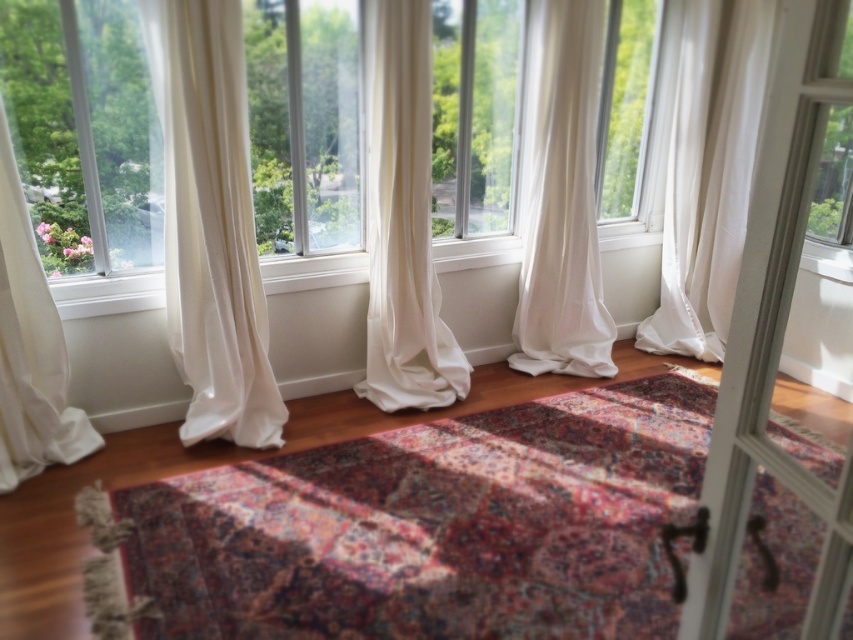
Which is more to the left, sheer white curtain at left or white sheer curtain at center?

Positioned to the left is sheer white curtain at left.

Who is more distant from viewer, (198, 44) or (541, 320)?

The point (541, 320) is more distant.

Is point (178, 128) positioned behind point (606, 333)?

No.

Find the location of `sheer white curtain at left`. sheer white curtain at left is located at coordinates (212, 221).

Is clear glass window at center closer to the viewer compared to white sheer curtain at left?

No, it is not.

Does point (252, 33) come in front of point (39, 465)?

No, (252, 33) is further to viewer.

Image resolution: width=853 pixels, height=640 pixels. I want to click on clear glass window at center, so click(x=305, y=124).

Can you confirm if white sheer curtain at center is smaller than white sheer curtain at left?

No.

Looking at this image, can you confirm if white sheer curtain at center is positioned below white sheer curtain at left?

No.

Is point (537, 131) farther from camera compared to point (15, 458)?

Yes, it is behind point (15, 458).

Locate an element on the screen. This screenshot has width=853, height=640. white sheer curtain at center is located at coordinates (561, 196).